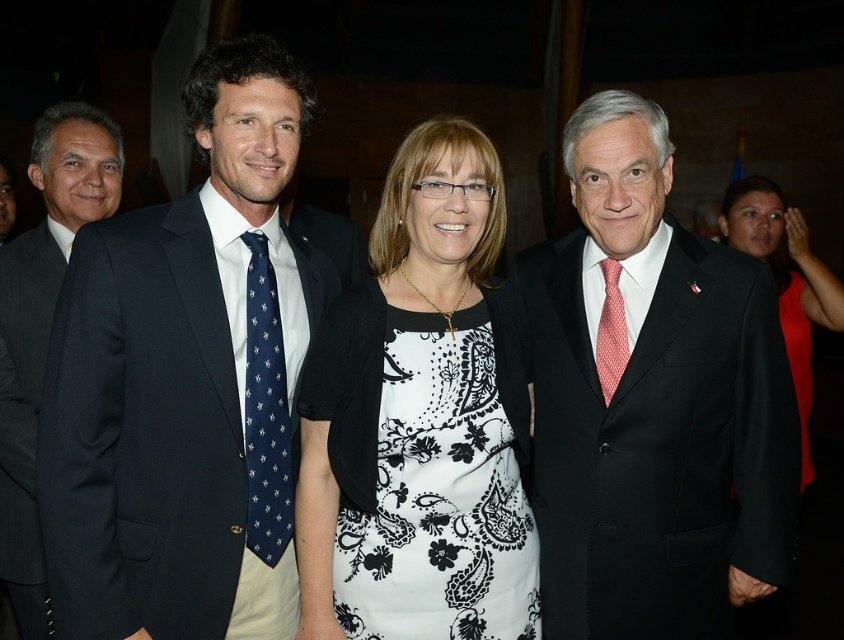
Is point (15, 554) positioned after point (268, 481)?

Yes, point (15, 554) is behind point (268, 481).

Which is above, dark gray pinstripe suit at left or navy silk tie at left?

navy silk tie at left is higher up.

Find the location of a particular element. This screenshot has height=640, width=844. dark gray pinstripe suit at left is located at coordinates (25, 412).

Does point (34, 598) come behind point (793, 362)?

No, it is in front of (793, 362).

Who is taller, dark gray pinstripe suit at left or black satin dress at center?

black satin dress at center

This screenshot has width=844, height=640. Describe the element at coordinates (25, 412) in the screenshot. I see `dark gray pinstripe suit at left` at that location.

I want to click on dark gray pinstripe suit at left, so click(25, 412).

Who is lower down, black suit at center or white printed fabric dress at center?

white printed fabric dress at center is below.

Is point (674, 614) in front of point (500, 310)?

That is True.

Where is `black suit at center`? The width and height of the screenshot is (844, 640). black suit at center is located at coordinates (653, 403).